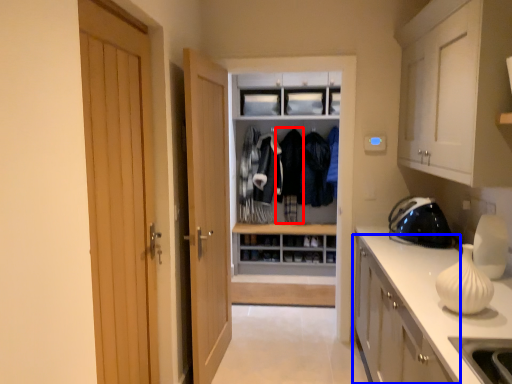
Question: Which point is closer to the camera, clothing (highlighted by a red box) or cabinetry (highlighted by a blue box)?

Choices:
 (A) clothing
 (B) cabinetry

Answer: (B)